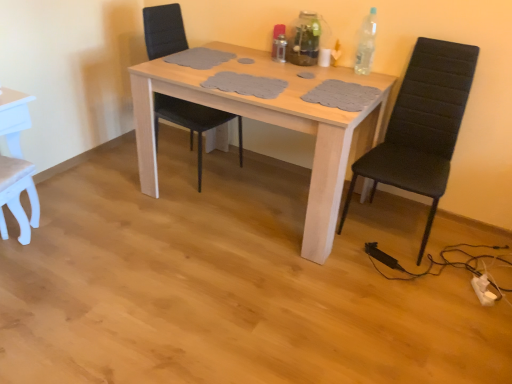
Where is `vacant area on top of light wood table at center (from a real-world perspective)`? The width and height of the screenshot is (512, 384). vacant area on top of light wood table at center (from a real-world perspective) is located at coordinates point(272,74).